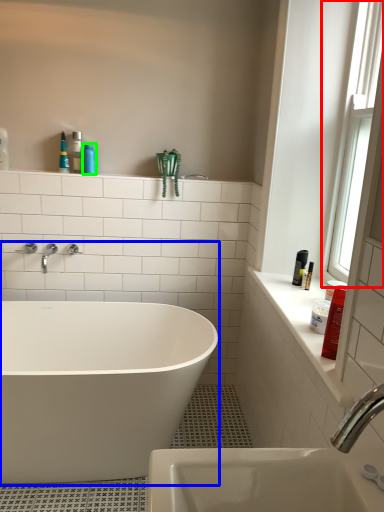
Question: Considering the real-world distances, which object is farthest from window (highlighted by a red box)? bathtub (highlighted by a blue box) or toiletry (highlighted by a green box)?

Choices:
 (A) bathtub
 (B) toiletry

Answer: (B)